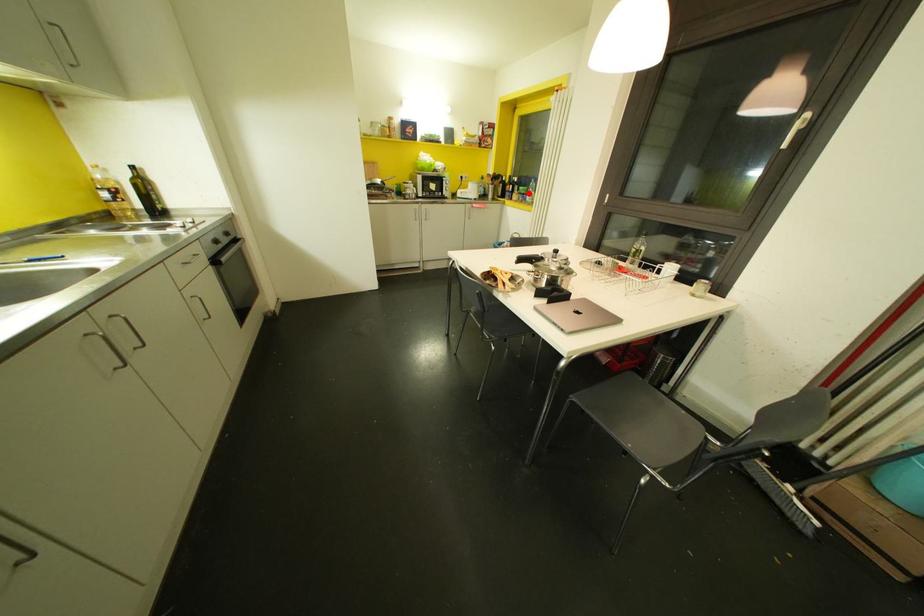
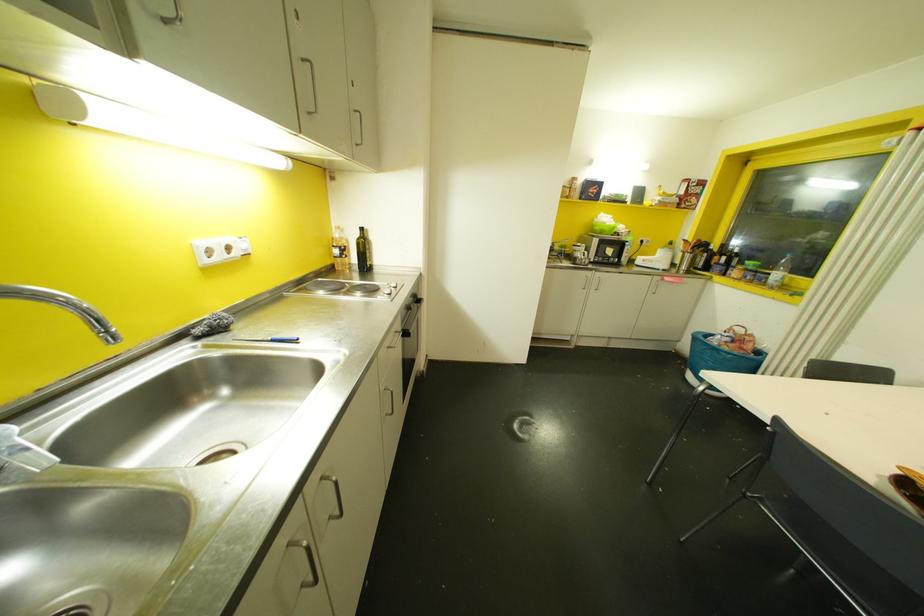
Question: A red point is marked in image1. In image2, is the corresponding 3D point closer to the camera or farther? Reply with the corresponding letter.

Choices:
 (A) The corresponding 3D point is closer.
 (B) The corresponding 3D point is farther.

Answer: (B)